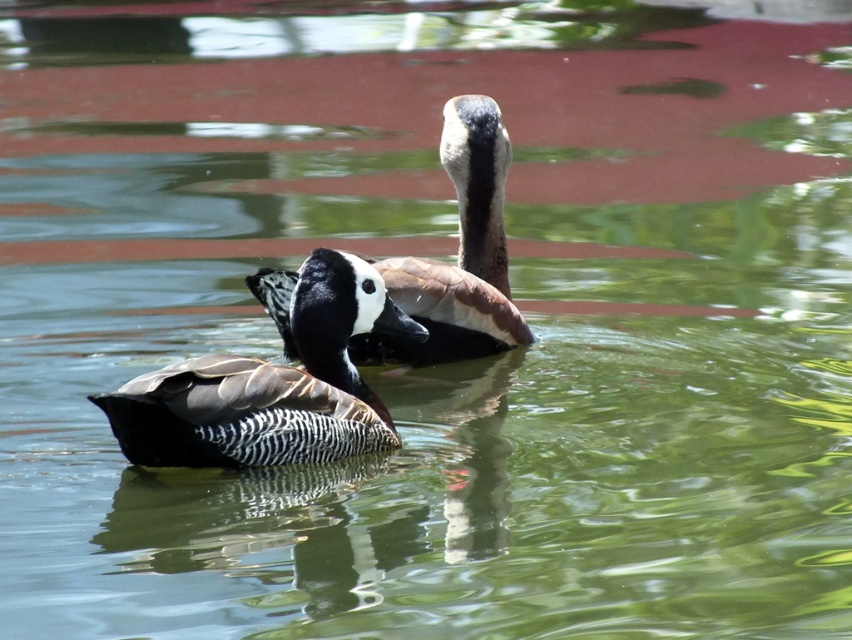
You are a wildlife photographer aiming to capture both the speckled brown duck at center and the white glossy duck at center in a single frame. Given their sizes, which duck would require you to adjust your camera focus more to ensure clarity?

The speckled brown duck at center is wider than the white glossy duck at center, so you would need to adjust the camera focus more for the speckled brown duck at center to ensure clarity.

Based on the photo, you are a photographer trying to capture both ducks in a single shot. The first duck is at point (202, 365) and the second duck is at point (401, 352). If you want to focus on the duck that is closer to the camera, which point should you aim your camera at?

Point (202, 365) is in front of point (401, 352), so you should aim your camera at point (202, 365) to focus on the closer duck.

You are a birdwatcher observing two ducks in the water. You notice the speckled brown duck at center and the white glossy duck at center. Which duck is shorter in height?

The speckled brown duck at center is not as tall as the white glossy duck at center, so the speckled brown duck at center is shorter.